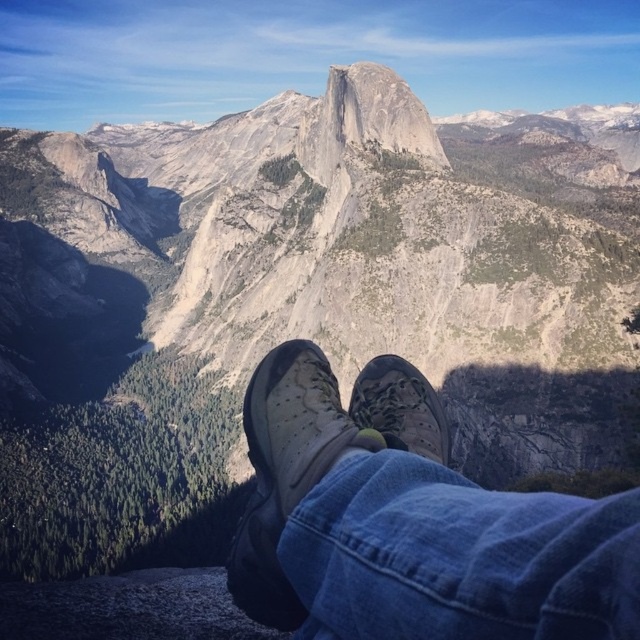
Question: Which object appears farthest from the camera in this image?

Choices:
 (A) camouflage fabric shoe at center
 (B) gray granite peak at center
 (C) leather textured shoe at center
 (D) worn leather shoes at center

Answer: (B)

Question: Is leather textured shoe at center to the right of camouflage fabric shoe at center from the viewer's perspective?

Choices:
 (A) yes
 (B) no

Answer: (B)

Question: Which object appears farthest from the camera in this image?

Choices:
 (A) gray granite peak at center
 (B) leather textured shoe at center

Answer: (A)

Question: Does gray granite peak at center have a larger size compared to camouflage fabric shoe at center?

Choices:
 (A) no
 (B) yes

Answer: (B)

Question: Can you confirm if worn leather shoes at center is smaller than camouflage fabric shoe at center?

Choices:
 (A) yes
 (B) no

Answer: (B)

Question: Estimate the real-world distances between objects in this image. Which object is farther from the gray granite peak at center?

Choices:
 (A) worn leather shoes at center
 (B) camouflage fabric shoe at center
 (C) leather textured shoe at center

Answer: (B)